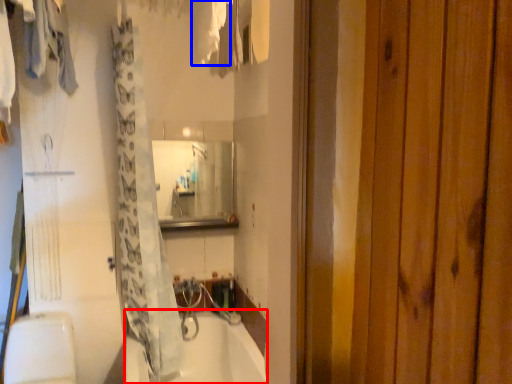
Question: Which object is further to the camera taking this photo, bathtub (highlighted by a red box) or clothing (highlighted by a blue box)?

Choices:
 (A) bathtub
 (B) clothing

Answer: (A)